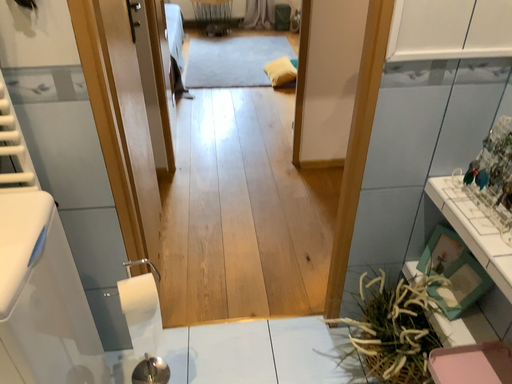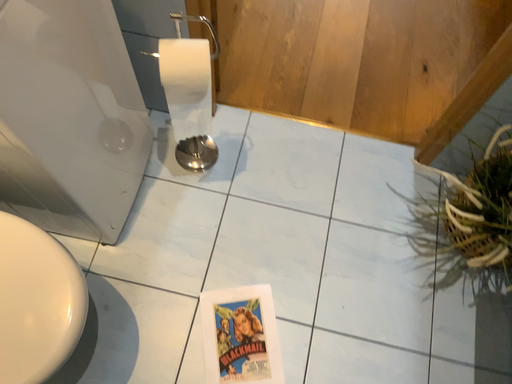
Question: Which way did the camera rotate in the video?

Choices:
 (A) rotated left
 (B) rotated right

Answer: (A)